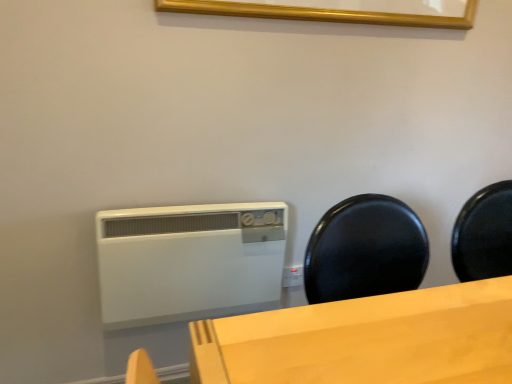
Question: Considering the positions of white plastic heater at center and gold wooden picture frame at upper center in the image, is white plastic heater at center taller or shorter than gold wooden picture frame at upper center?

Choices:
 (A) tall
 (B) short

Answer: (A)

Question: Considering their positions, is white plastic heater at center located in front of or behind gold wooden picture frame at upper center?

Choices:
 (A) behind
 (B) front

Answer: (A)

Question: Is point (145, 304) positioned closer to the camera than point (310, 19)?

Choices:
 (A) closer
 (B) farther

Answer: (B)

Question: Based on their positions, is gold wooden picture frame at upper center located to the left or right of white plastic heater at center?

Choices:
 (A) right
 (B) left

Answer: (A)

Question: Is point (338, 8) closer or farther from the camera than point (274, 271)?

Choices:
 (A) closer
 (B) farther

Answer: (A)

Question: Considering the positions of gold wooden picture frame at upper center and white plastic heater at center in the image, is gold wooden picture frame at upper center bigger or smaller than white plastic heater at center?

Choices:
 (A) big
 (B) small

Answer: (B)

Question: Is gold wooden picture frame at upper center situated inside white plastic heater at center or outside?

Choices:
 (A) inside
 (B) outside

Answer: (B)